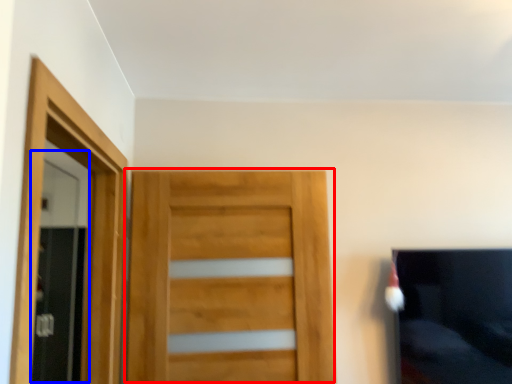
Question: Which object appears closest to the camera in this image, door (highlighted by a red box) or screen door (highlighted by a blue box)?

Choices:
 (A) door
 (B) screen door

Answer: (A)